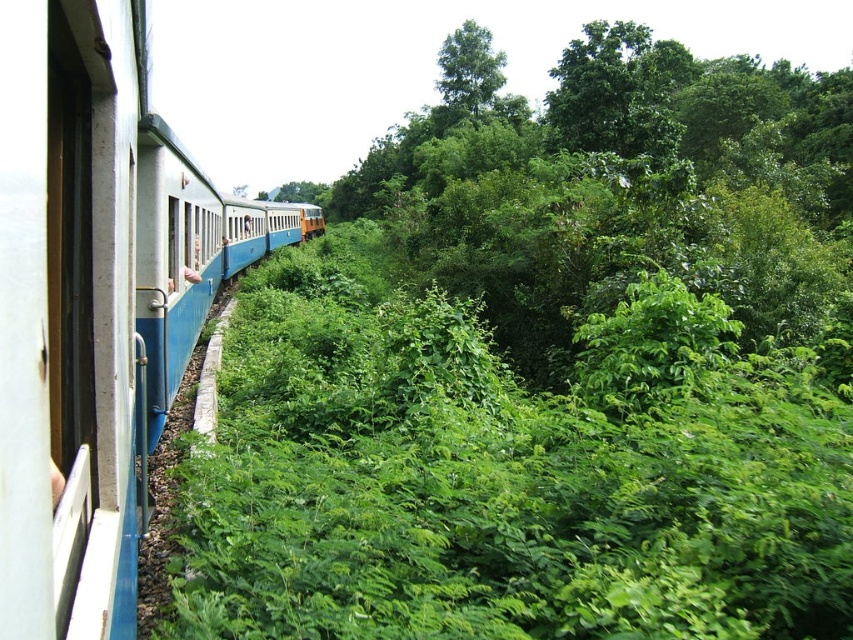
Which of these two, blue painted metal train at left or green leafy tree at upper center, stands taller?

With more height is green leafy tree at upper center.

Does blue painted metal train at left have a greater width compared to green leafy tree at upper center?

Yes.

The height and width of the screenshot is (640, 853). I want to click on blue painted metal train at left, so click(x=94, y=305).

What are the coordinates of `blue painted metal train at left` in the screenshot? It's located at (94, 305).

Which of these two, green leafy tree at center or green leafy tree at upper center, stands shorter?

green leafy tree at upper center is shorter.

Is green leafy tree at center shorter than green leafy tree at upper center?

No, green leafy tree at center is not shorter than green leafy tree at upper center.

Does point (631, 186) come in front of point (480, 38)?

Yes, point (631, 186) is in front of point (480, 38).

You are a GUI agent. You are given a task and a screenshot of the screen. Output one action in this format:
    pyautogui.click(x=<x>, y=<y>)
    Task: Click on the green leafy tree at center
    Image resolution: width=853 pixels, height=640 pixels.
    Given the screenshot: What is the action you would take?
    pyautogui.click(x=624, y=189)

Is green leafy tree at center in front of blue painted metal train at left?

No, it is behind blue painted metal train at left.

Is point (496, 168) less distant than point (111, 179)?

No, it is not.

This screenshot has width=853, height=640. I want to click on green leafy tree at center, so click(x=624, y=189).